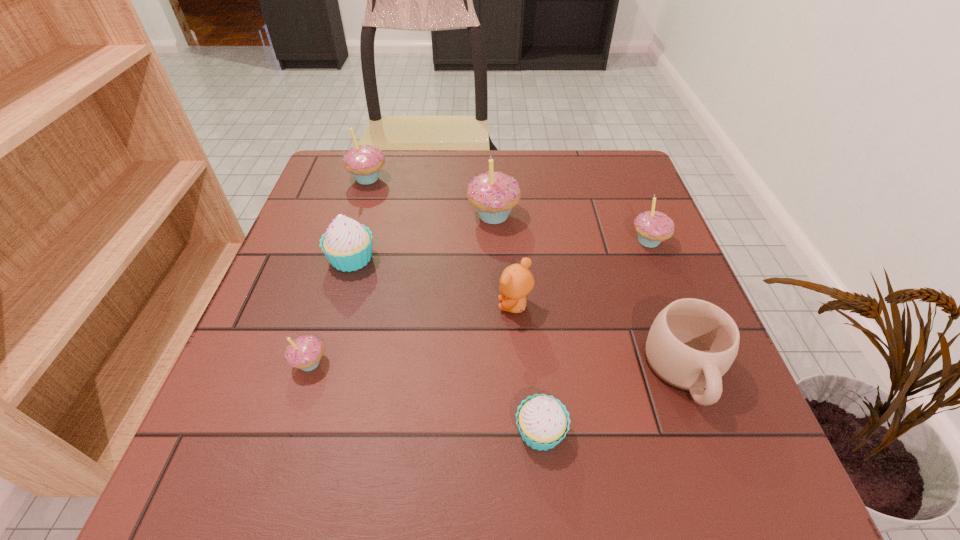
You are a GUI agent. You are given a task and a screenshot of the screen. Output one action in this format:
    pyautogui.click(x=<x>, y=<y>)
    Task: Click on the mug
    
    Given the screenshot: What is the action you would take?
    pyautogui.click(x=692, y=343)

The width and height of the screenshot is (960, 540). I want to click on the smallest pink cupcake, so click(304, 352).

I want to click on the second nearest cupcake, so click(x=304, y=352).

Find the location of a particular element. the smaller white cupcake is located at coordinates (542, 421).

This screenshot has height=540, width=960. Identify the location of the nearer white cupcake. (542, 421).

Where is `vacant region located on the right of the tallest cupcake`? vacant region located on the right of the tallest cupcake is located at coordinates (618, 215).

Where is `blank space located 0.050m on the back of the farthest object`? This screenshot has width=960, height=540. blank space located 0.050m on the back of the farthest object is located at coordinates (373, 158).

The image size is (960, 540). Identify the location of vacant space located 0.360m on the left of the rightmost cupcake. (472, 241).

At what (x,y) coordinates should I click in order to perform the action: click on blank area located on the back of the farther white cupcake. Please return your answer as a coordinate pair (x, y). The height and width of the screenshot is (540, 960). Looking at the image, I should click on (380, 162).

In order to click on free location located 0.050m on the face of the teddy bear in this screenshot , I will do `click(472, 306)`.